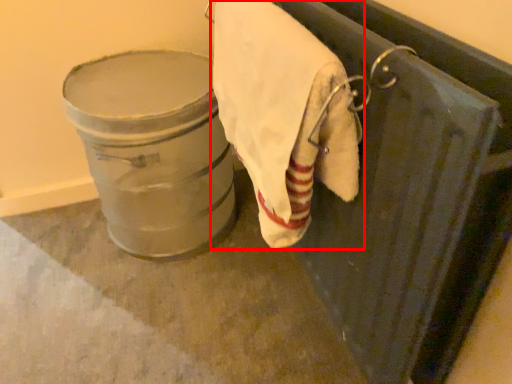
Question: Where is towel (annotated by the red box) located in relation to lift in the image?

Choices:
 (A) right
 (B) left

Answer: (A)